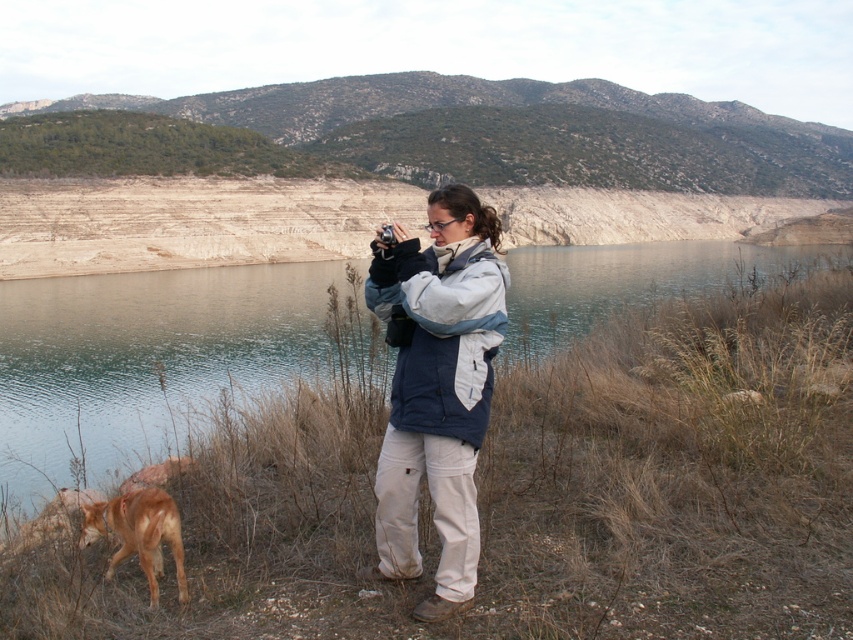
You are a photographer trying to capture the brown fur dog at lower left in your shot. The clear water at center is blocking your view. Can you adjust your position to see the dog without the water obstructing it?

The clear water at center is positioned over the brown fur dog at lower left, so moving your camera position downward or to the side might allow you to see the dog without the water blocking it.